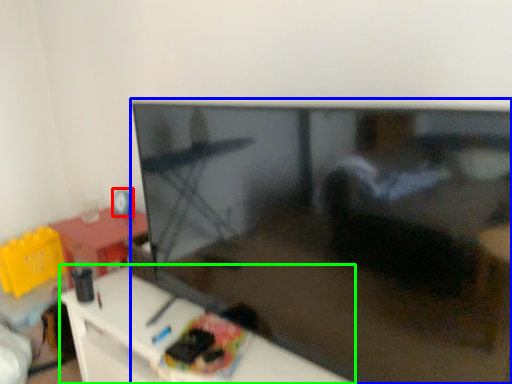
Question: Which is farther away from toy (highlighted by a red box)? television (highlighted by a blue box) or furniture (highlighted by a green box)?

Choices:
 (A) television
 (B) furniture

Answer: (A)